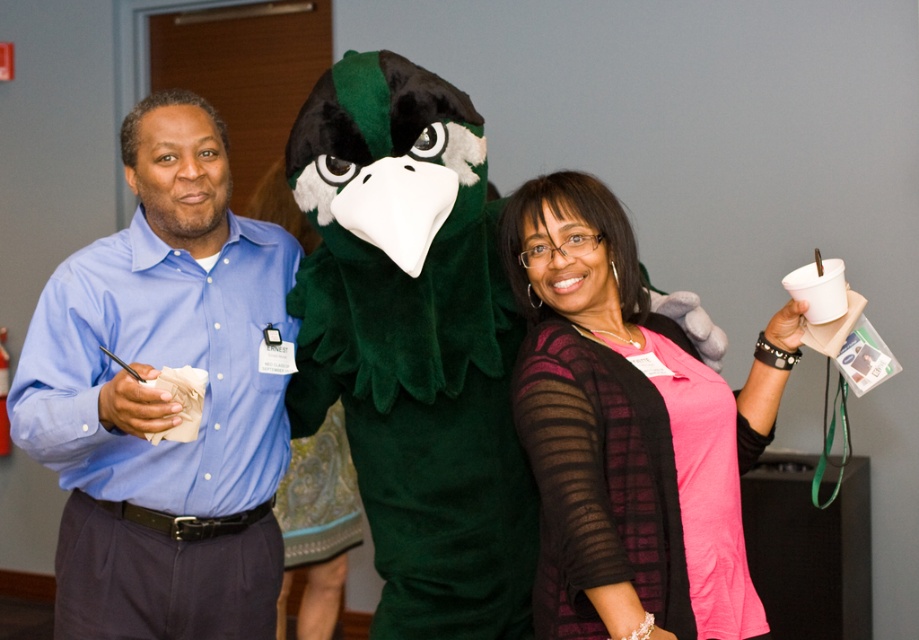
Does green fuzzy mascot at center have a smaller size compared to pink matte shirt at center?

No, green fuzzy mascot at center is not smaller than pink matte shirt at center.

The image size is (919, 640). I want to click on green fuzzy mascot at center, so click(415, 356).

Is blue shirt at left wider than green fuzzy mascot at center?

Incorrect, blue shirt at left's width does not surpass green fuzzy mascot at center's.

Who is lower down, blue shirt at left or green fuzzy mascot at center?

blue shirt at left is below.

Who is more distant from viewer, (54, 388) or (495, 416)?

The point (495, 416) is more distant.

What are the coordinates of `blue shirt at left` in the screenshot? It's located at (163, 397).

From the picture: Does blue shirt at left appear on the left side of pink matte shirt at center?

Correct, you'll find blue shirt at left to the left of pink matte shirt at center.

Find the location of a particular element. Image resolution: width=919 pixels, height=640 pixels. blue shirt at left is located at coordinates point(163,397).

Locate an element on the screen. This screenshot has width=919, height=640. blue shirt at left is located at coordinates (163, 397).